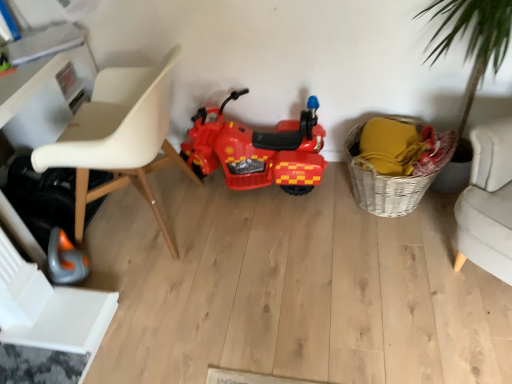
This screenshot has height=384, width=512. I want to click on vacant point above white plastic swivel chair at lower left (from a real-world perspective), so click(64, 314).